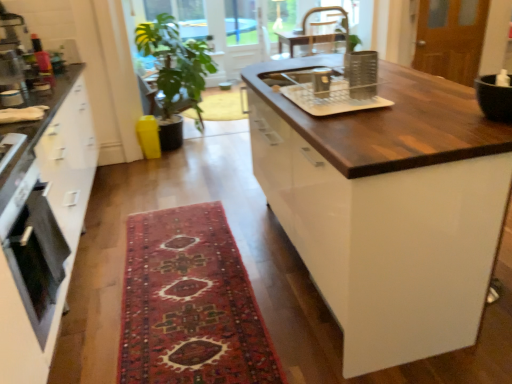
Question: From the image's perspective, would you say carpeted rug at center is shown under green leafy plant at center?

Choices:
 (A) no
 (B) yes

Answer: (B)

Question: Can you confirm if carpeted rug at center is taller than green leafy plant at center?

Choices:
 (A) no
 (B) yes

Answer: (A)

Question: From a real-world perspective, is carpeted rug at center on green leafy plant at center?

Choices:
 (A) no
 (B) yes

Answer: (A)

Question: Can you confirm if carpeted rug at center is positioned to the right of green leafy plant at center?

Choices:
 (A) no
 (B) yes

Answer: (B)

Question: Would you say carpeted rug at center is outside green leafy plant at center?

Choices:
 (A) yes
 (B) no

Answer: (A)

Question: Considering the relative sizes of carpeted rug at center and green leafy plant at center in the image provided, is carpeted rug at center wider than green leafy plant at center?

Choices:
 (A) no
 (B) yes

Answer: (B)

Question: From the image's perspective, does green leafy plant at upper center appear lower than dark wood countertop at center?

Choices:
 (A) yes
 (B) no

Answer: (B)

Question: From a real-world perspective, does green leafy plant at upper center stand above dark wood countertop at center?

Choices:
 (A) no
 (B) yes

Answer: (B)

Question: Does green leafy plant at upper center lie behind dark wood countertop at center?

Choices:
 (A) yes
 (B) no

Answer: (A)

Question: Is green leafy plant at upper center to the left of dark wood countertop at center from the viewer's perspective?

Choices:
 (A) yes
 (B) no

Answer: (A)

Question: Does green leafy plant at upper center have a smaller size compared to dark wood countertop at center?

Choices:
 (A) no
 (B) yes

Answer: (B)

Question: Is the surface of green leafy plant at upper center in direct contact with dark wood countertop at center?

Choices:
 (A) yes
 (B) no

Answer: (B)

Question: Is green leafy plant at center oriented towards green leafy plant at upper center?

Choices:
 (A) yes
 (B) no

Answer: (B)